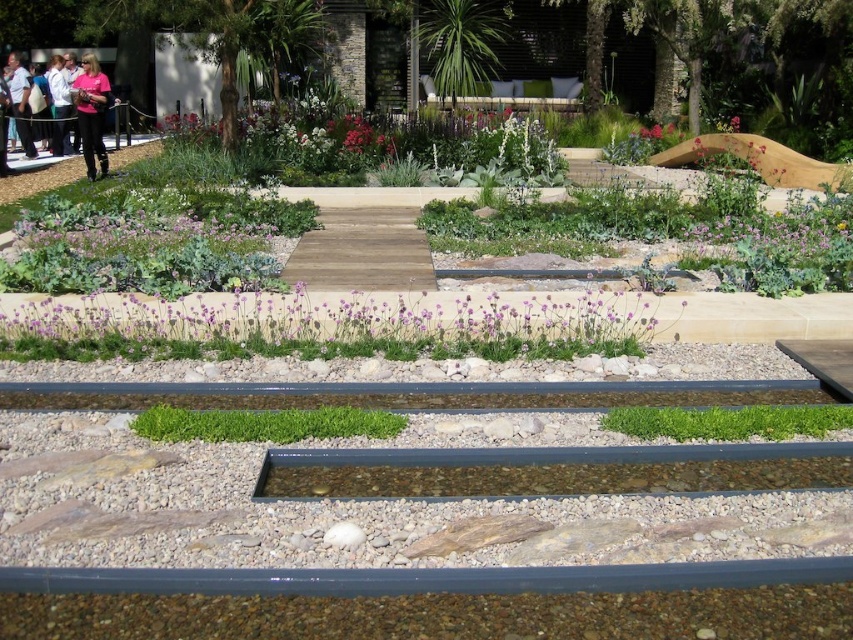
Who is more forward, (97, 122) or (19, 125)?

Positioned in front is point (97, 122).

Is pink fabric at left positioned in front of pink fabric at upper left?

Yes, pink fabric at left is closer to the viewer.

Is point (73, 99) more distant than point (28, 129)?

No, it is in front of (28, 129).

The width and height of the screenshot is (853, 640). I want to click on pink fabric at left, so click(x=91, y=113).

Does green grass at center have a lesser width compared to pink fabric at left?

No.

This screenshot has width=853, height=640. What are the coordinates of `green grass at center` in the screenshot? It's located at (264, 422).

Locate an element on the screen. The height and width of the screenshot is (640, 853). green grass at center is located at coordinates (264, 422).

Is brown wooden path at center smaller than pink fabric at upper left?

Yes, brown wooden path at center is smaller than pink fabric at upper left.

Who is positioned more to the left, brown wooden path at center or pink fabric at upper left?

pink fabric at upper left is more to the left.

Who is more forward, (x=351, y=266) or (x=33, y=154)?

Point (x=351, y=266) is in front.

Find the location of a particular element. brown wooden path at center is located at coordinates (363, 241).